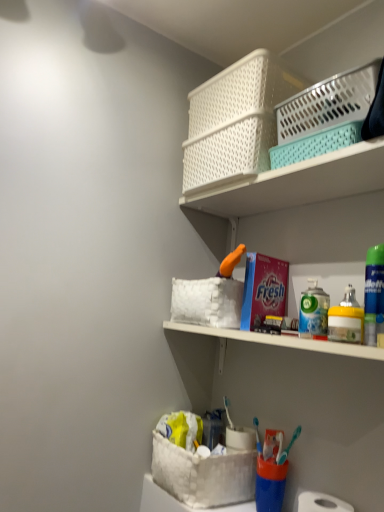
Question: Is white fabric basket at lower center, the first basket container in the bottom-to-top sequence, positioned far away from matte red detergent at center?

Choices:
 (A) yes
 (B) no

Answer: (B)

Question: Could you tell me if white fabric basket at lower center, which is counted as the 3th basket container, starting from the top, is turned towards matte red detergent at center?

Choices:
 (A) yes
 (B) no

Answer: (B)

Question: From the image's perspective, is white fabric basket at lower center, which is counted as the 3th basket container, starting from the top, beneath matte red detergent at center?

Choices:
 (A) no
 (B) yes

Answer: (B)

Question: Considering the relative positions of white fabric basket at lower center, which is counted as the 3th basket container, starting from the top, and matte red detergent at center in the image provided, is white fabric basket at lower center, which is counted as the 3th basket container, starting from the top, to the left of matte red detergent at center from the viewer's perspective?

Choices:
 (A) no
 (B) yes

Answer: (B)

Question: Is matte red detergent at center at the back of white fabric basket at lower center, which is counted as the 3th basket container, starting from the top?

Choices:
 (A) yes
 (B) no

Answer: (B)

Question: Considering the relative sizes of white fabric basket at lower center, which is counted as the 3th basket container, starting from the top, and matte red detergent at center in the image provided, is white fabric basket at lower center, which is counted as the 3th basket container, starting from the top, wider than matte red detergent at center?

Choices:
 (A) no
 (B) yes

Answer: (B)

Question: Is white plastic basket at upper right, positioned as the 2th basket container in top-to-bottom order, placed right next to white fabric basket at lower center, which is counted as the 3th basket container, starting from the top?

Choices:
 (A) no
 (B) yes

Answer: (A)

Question: Is white plastic basket at upper right, positioned as the 2th basket container in top-to-bottom order, outside of white fabric basket at lower center, the first basket container in the bottom-to-top sequence?

Choices:
 (A) yes
 (B) no

Answer: (A)

Question: Does white plastic basket at upper right, the second basket container when ordered from bottom to top, have a greater width compared to white fabric basket at lower center, which is counted as the 3th basket container, starting from the top?

Choices:
 (A) no
 (B) yes

Answer: (A)

Question: Is white plastic basket at upper right, positioned as the 2th basket container in top-to-bottom order, taller than white fabric basket at lower center, which is counted as the 3th basket container, starting from the top?

Choices:
 (A) yes
 (B) no

Answer: (B)

Question: From the image's perspective, would you say white plastic basket at upper right, positioned as the 2th basket container in top-to-bottom order, is shown under white fabric basket at lower center, the first basket container in the bottom-to-top sequence?

Choices:
 (A) no
 (B) yes

Answer: (A)

Question: Is white plastic basket at upper right, the second basket container when ordered from bottom to top, surrounding white fabric basket at lower center, which is counted as the 3th basket container, starting from the top?

Choices:
 (A) yes
 (B) no

Answer: (B)

Question: Can you confirm if white matte toilet paper at lower right is thinner than white plastic basket at upper center?

Choices:
 (A) no
 (B) yes

Answer: (B)